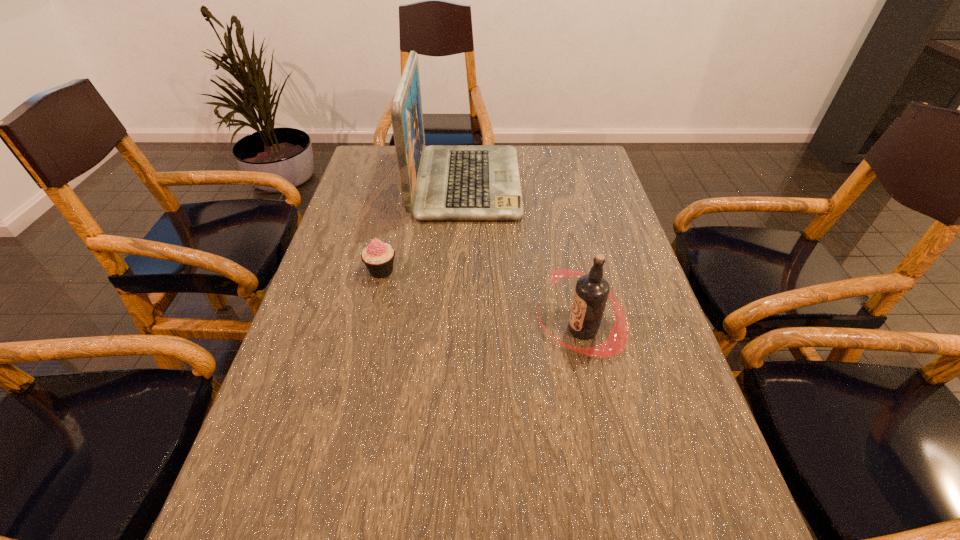
Where is `free space that is in between the tallest object and the cupcake`? free space that is in between the tallest object and the cupcake is located at coordinates (423, 227).

Find the location of `free space between the farthest object and the cupcake`. free space between the farthest object and the cupcake is located at coordinates (423, 227).

Where is `vacant space that is in between the second tallest object and the laptop computer`? vacant space that is in between the second tallest object and the laptop computer is located at coordinates (524, 256).

Locate an element on the screen. free space between the laptop computer and the shortest object is located at coordinates (423, 227).

Select which object appears as the second closest to the farthest object. Please provide its 2D coordinates. Your answer should be formatted as a tuple, i.e. [(x, y)], where the tuple contains the x and y coordinates of a point satisfying the conditions above.

[(591, 293)]

Identify which object is the second closest to the cupcake. Please provide its 2D coordinates. Your answer should be formatted as a tuple, i.e. [(x, y)], where the tuple contains the x and y coordinates of a point satisfying the conditions above.

[(591, 293)]